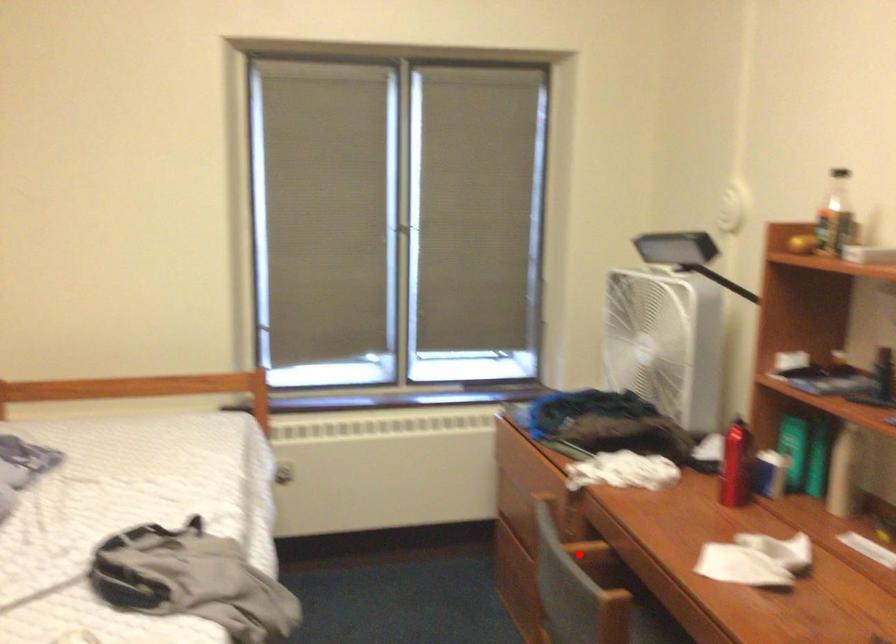
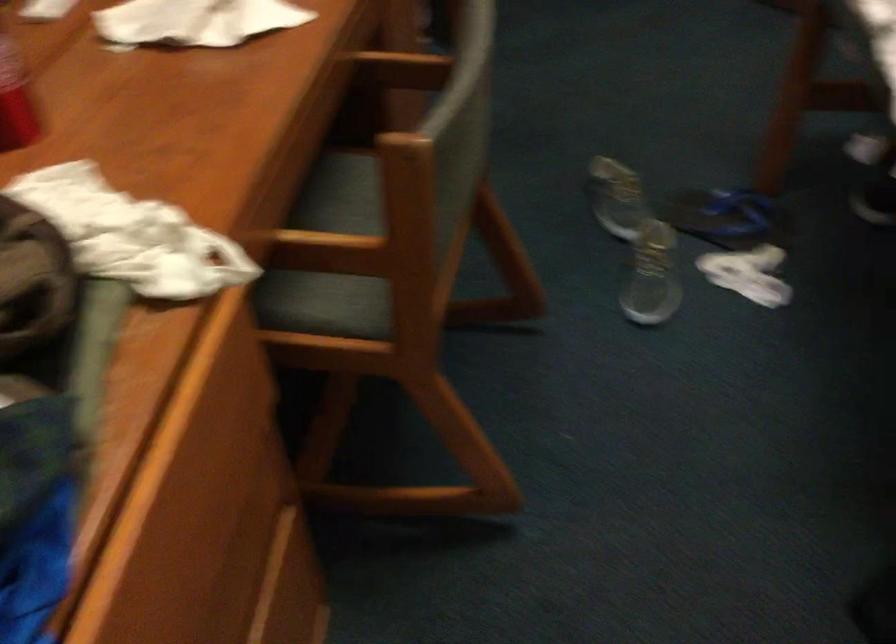
Locate, in the second image, the point that corresponds to the highlighted location in the first image.

(339, 250)